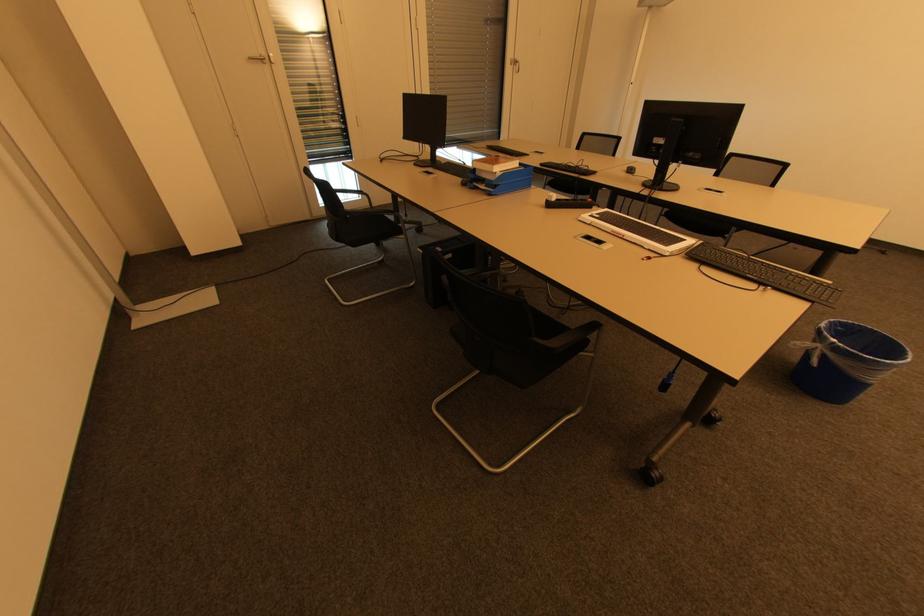
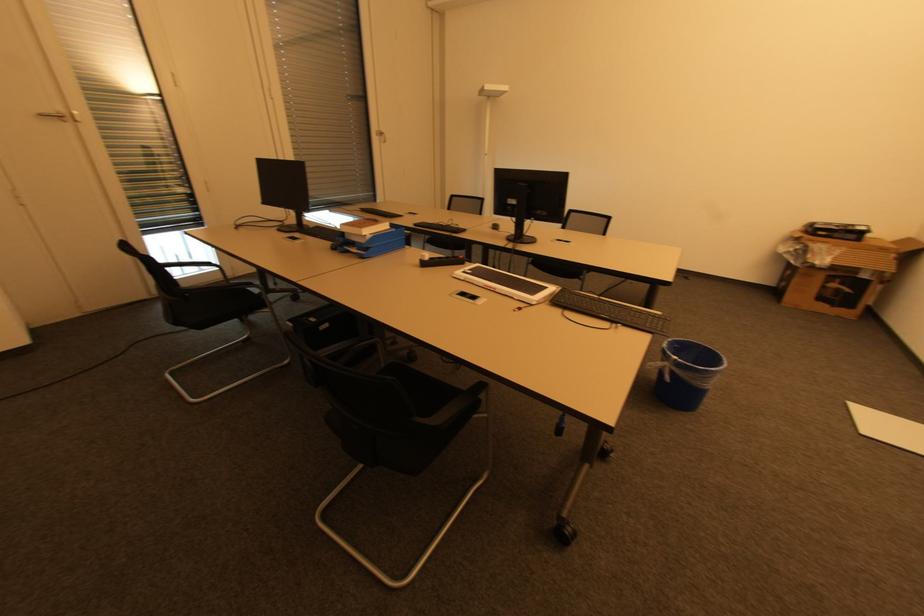
Question: Based on the continuous images, in which direction is the camera rotating? Reply with the corresponding letter.

Choices:
 (A) Left
 (B) Right
 (C) Up
 (D) Down

Answer: (B)